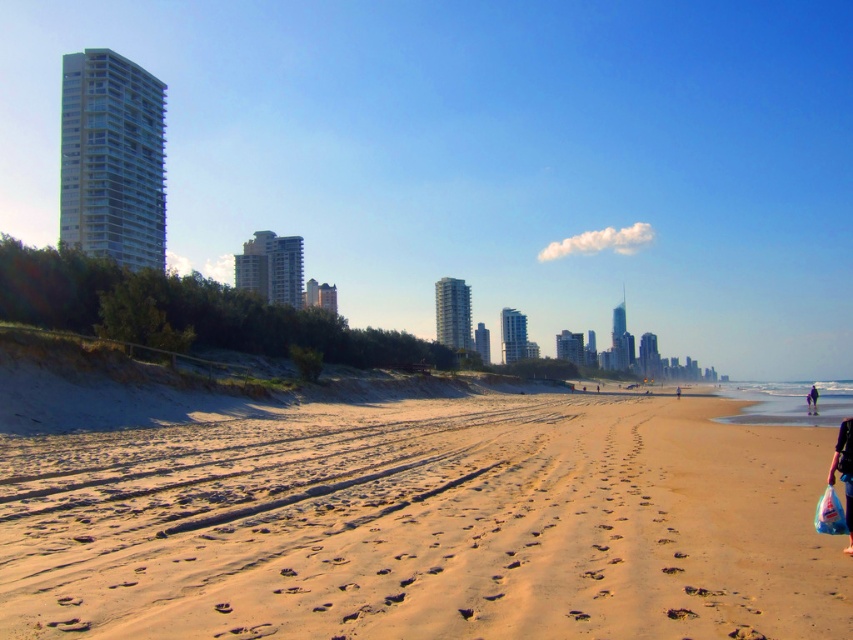
Can you confirm if sandy beach at lower center is wider than black fabric person at lower right?

Incorrect, sandy beach at lower center's width does not surpass black fabric person at lower right's.

Does sandy beach at lower center lie in front of black fabric person at lower right?

Yes.

The height and width of the screenshot is (640, 853). Find the location of `sandy beach at lower center`. sandy beach at lower center is located at coordinates (426, 524).

The image size is (853, 640). Find the location of `sandy beach at lower center`. sandy beach at lower center is located at coordinates (426, 524).